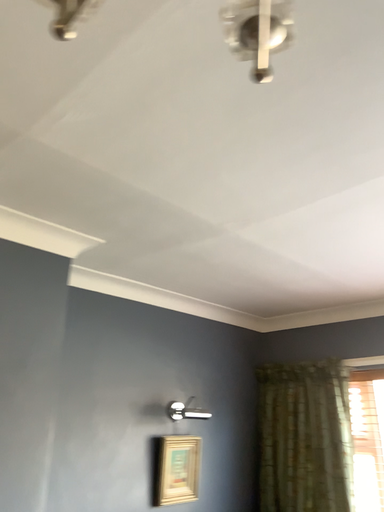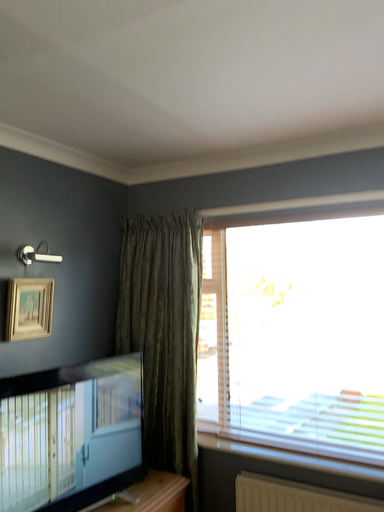
Question: Which way did the camera rotate in the video?

Choices:
 (A) rotated right
 (B) rotated left

Answer: (A)